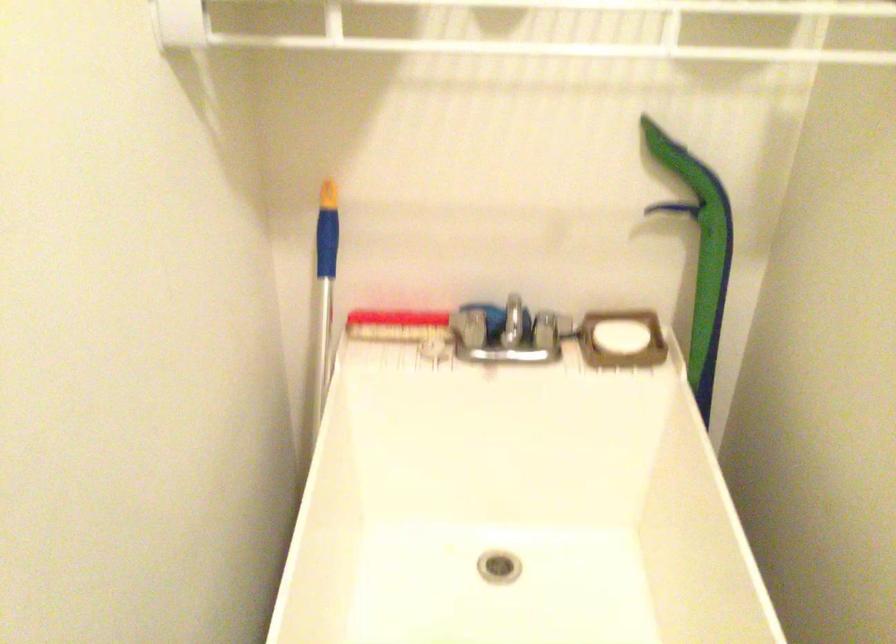
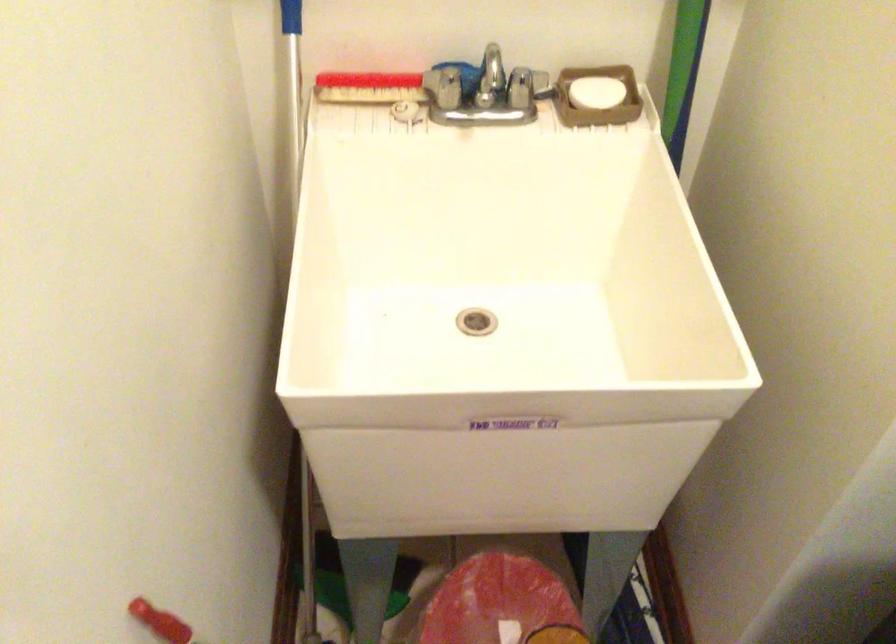
Which direction would the cameraman need to move to produce the second image?

The cameraman walked toward left, backward.